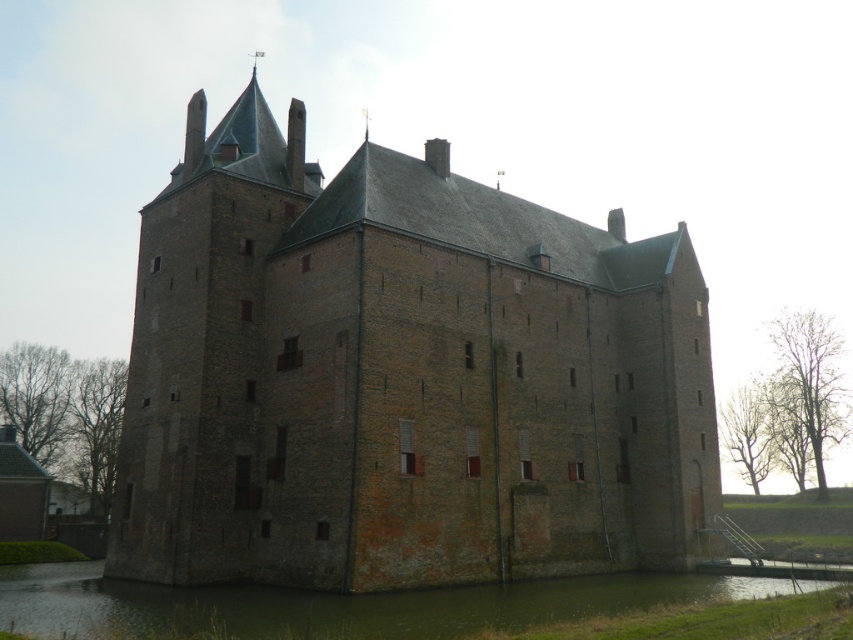
You are standing at the base of the historic brick building and want to know how far the point at coordinate point (544,232) is from you. Can you determine the distance?

The distance of point (544,232) from camera is 238.60 feet.

You are standing at the base of the brown brick castle at center and want to reach the green grassy bank at lower center. Which direction should you move to get there?

The green grassy bank at lower center is behind the brown brick castle at center, so you should move backward to reach it.